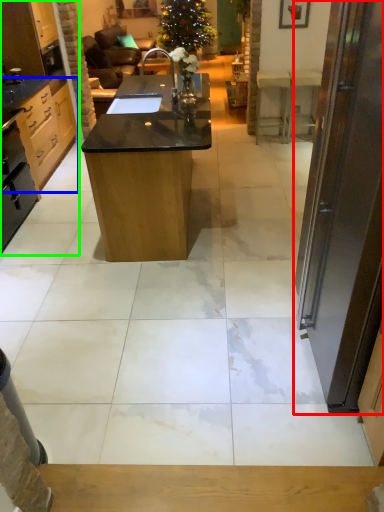
Question: Estimate the real-world distances between objects in this image. Which object is farther from door (highlighted by a red box), cabinetry (highlighted by a blue box) or cabinetry (highlighted by a green box)?

Choices:
 (A) cabinetry
 (B) cabinetry

Answer: (A)